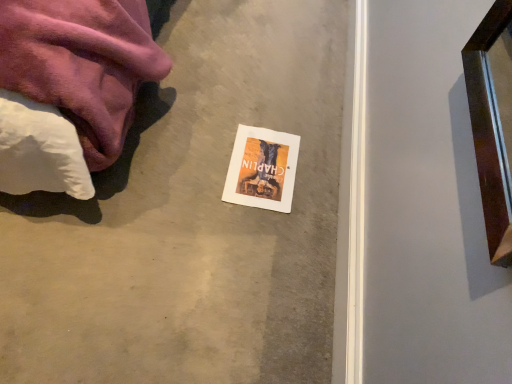
Where is `vacant space underneath orange matte paper flyer at center (from a real-world perspective)`? The image size is (512, 384). vacant space underneath orange matte paper flyer at center (from a real-world perspective) is located at coordinates (260, 164).